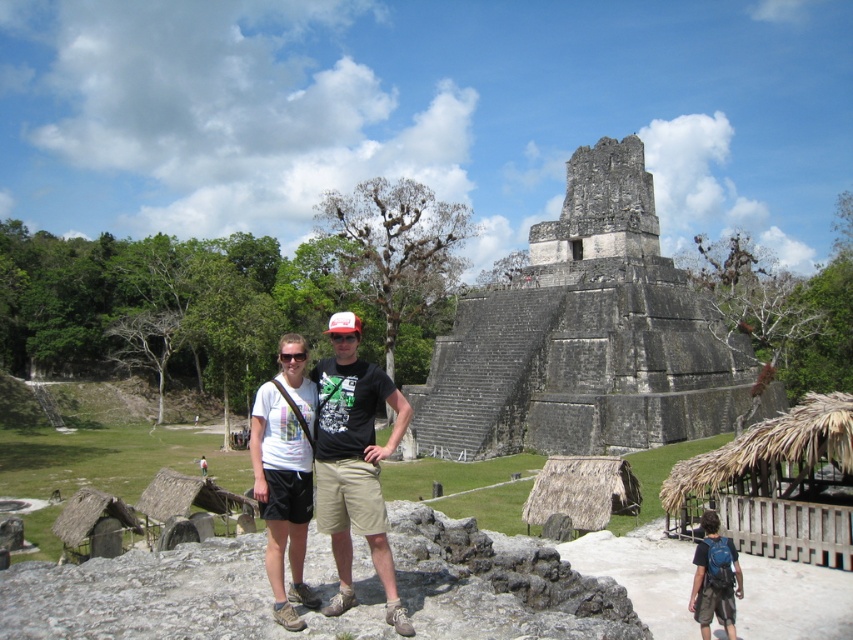
The width and height of the screenshot is (853, 640). Find the location of `gray stone ruins at center`. gray stone ruins at center is located at coordinates (583, 337).

Is gray stone ruins at center to the left of white matte t-shirt at center from the viewer's perspective?

No, gray stone ruins at center is not to the left of white matte t-shirt at center.

Which of these two, gray stone ruins at center or white matte t-shirt at center, stands taller?

gray stone ruins at center is taller.

The width and height of the screenshot is (853, 640). What are the coordinates of `gray stone ruins at center` in the screenshot? It's located at (583, 337).

Is the position of white cotton shirt at center less distant than that of white matte t-shirt at center?

Yes, white cotton shirt at center is in front of white matte t-shirt at center.

Does point (334, 388) lie behind point (260, 496)?

Yes.

The width and height of the screenshot is (853, 640). What are the coordinates of `white cotton shirt at center` in the screenshot? It's located at (354, 461).